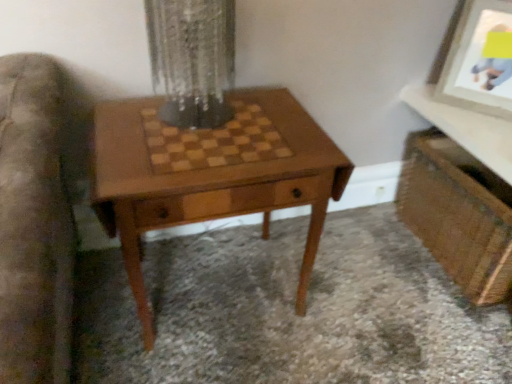
Locate an element on the screen. This screenshot has height=384, width=512. vacant space in wooden chess table at center (from a real-world perspective) is located at coordinates (218, 295).